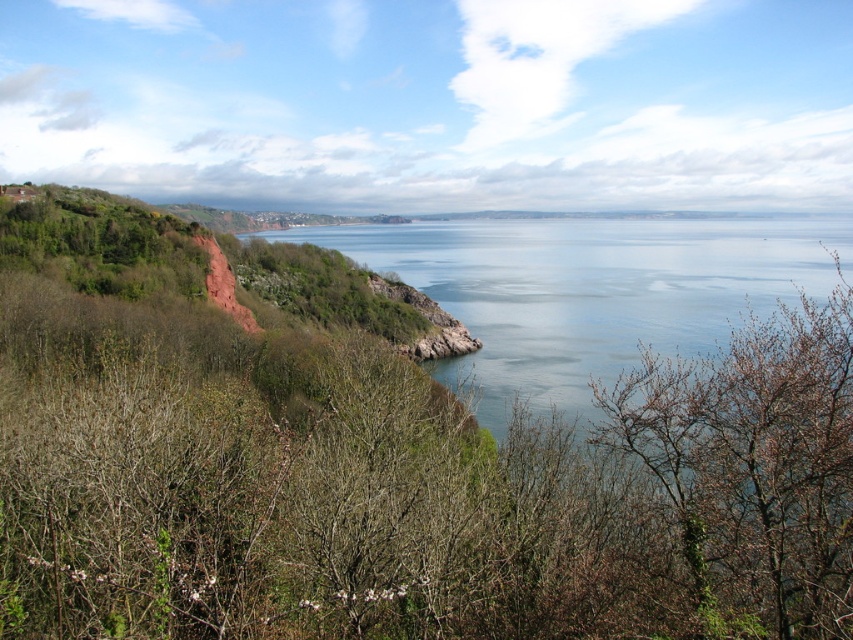
A hiker wants to cross from the cliff to the blue water at center. The hiker has a rope that is 30 meters long. Can the hiker safely cross using the rope?

The distance between the cliff and the blue water at center is 33.40 meters. The rope is only 30 meters long, so it is not long enough. The hiker cannot safely cross using the rope.

You are standing on a cliff overlooking the coastal landscape. You see the blue water at center and the bare branches at center. Which one is higher in elevation?

The blue water at center is located above the bare branches at center, so it is higher in elevation.

In the scene shown: You are standing at the point labeled as point (590, 291) in the image. What do you see directly in front of you?

The point (590, 291) indicates blue water at center, so you would see blue water at center directly in front of you.